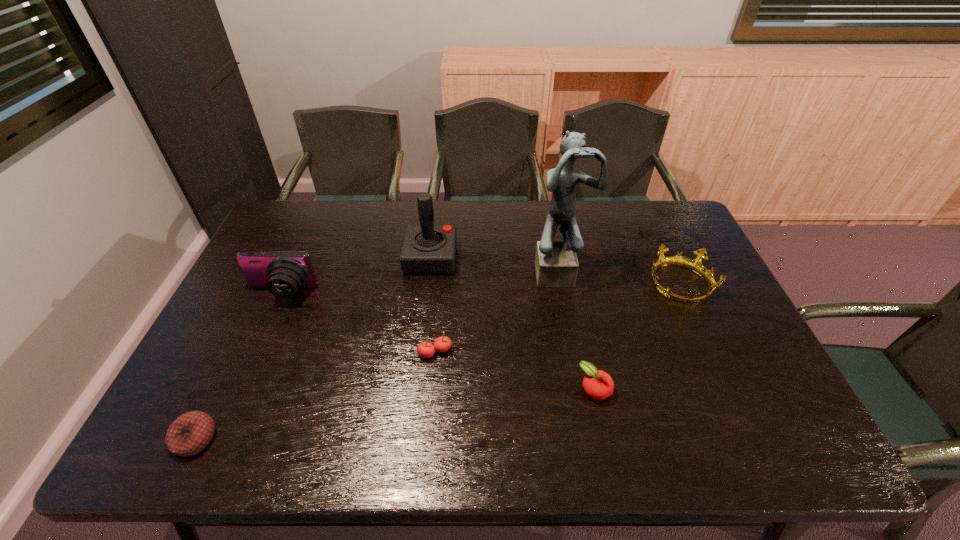
Find the location of `free space located 0.300m on the back of the rightmost object`. free space located 0.300m on the back of the rightmost object is located at coordinates (644, 208).

I want to click on vacant position located 0.070m on the left of the cherry, so click(391, 352).

Locate an element on the screen. The height and width of the screenshot is (540, 960). vacant region located on the left of the apple is located at coordinates (557, 389).

At what (x,y) coordinates should I click in order to perform the action: click on vacant space located on the back of the beanbag. Please return your answer as a coordinate pair (x, y). Looking at the image, I should click on (234, 357).

Locate an element on the screen. object located in the far edge section of the desktop is located at coordinates (427, 248).

Identify the location of object at the near edge. (190, 433).

In order to click on camera located at the left edge in this screenshot , I will do `click(283, 273)`.

Find the location of a particular element. The width and height of the screenshot is (960, 540). beanbag present at the left edge is located at coordinates (190, 433).

Where is `object that is at the right edge`? The width and height of the screenshot is (960, 540). object that is at the right edge is located at coordinates (695, 265).

Where is `object present at the near left corner`? The width and height of the screenshot is (960, 540). object present at the near left corner is located at coordinates (190, 433).